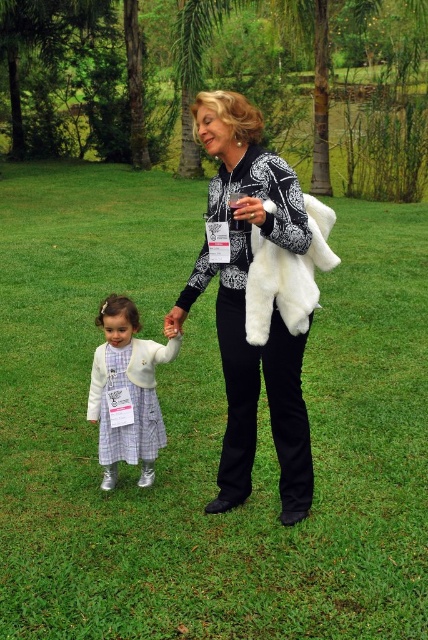
You are a photographer trying to capture a closeup of the fur texture on the coat. Which coat should you focus on, the white fur coat at center or the white fluffy fur coat at center?

The white fur coat at center is closer to the viewer than the white fluffy fur coat at center, so you should focus on the white fur coat at center to capture the fur texture closeup.

You are a photographer trying to capture the two subjects in the scene. You want to ensure that both the plaid fabric dress at center and the white fluffy fur coat at center are clearly visible in your shot. Based on their positions, which item should you focus on first to ensure proper framing?

The plaid fabric dress at center is to the left of the white fluffy fur coat at center, so you should focus on the plaid fabric dress at center first to ensure proper framing.